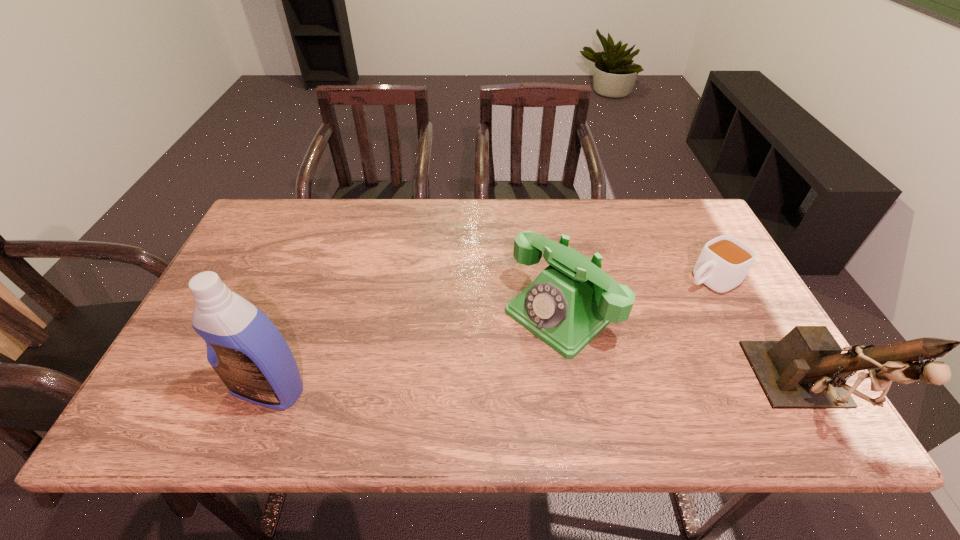
Locate an element on the screen. empty space between the telephone and the leftmost object is located at coordinates (416, 350).

Where is `unoccupied area between the detergent and the figurine`? unoccupied area between the detergent and the figurine is located at coordinates (538, 392).

Locate an element on the screen. object that is the nearest to the shortest object is located at coordinates (806, 369).

Find the location of a particular element. object that is the nearest to the leftmost object is located at coordinates (571, 301).

Where is `free space that satisfies the following two spatial constraints: 1. on the back side of the leftmost object; 2. on the right side of the cup`? This screenshot has height=540, width=960. free space that satisfies the following two spatial constraints: 1. on the back side of the leftmost object; 2. on the right side of the cup is located at coordinates (311, 279).

Where is `free space that satisfies the following two spatial constraints: 1. on the back side of the third object from right to left; 2. on the right side of the shortest object`? The height and width of the screenshot is (540, 960). free space that satisfies the following two spatial constraints: 1. on the back side of the third object from right to left; 2. on the right side of the shortest object is located at coordinates (556, 279).